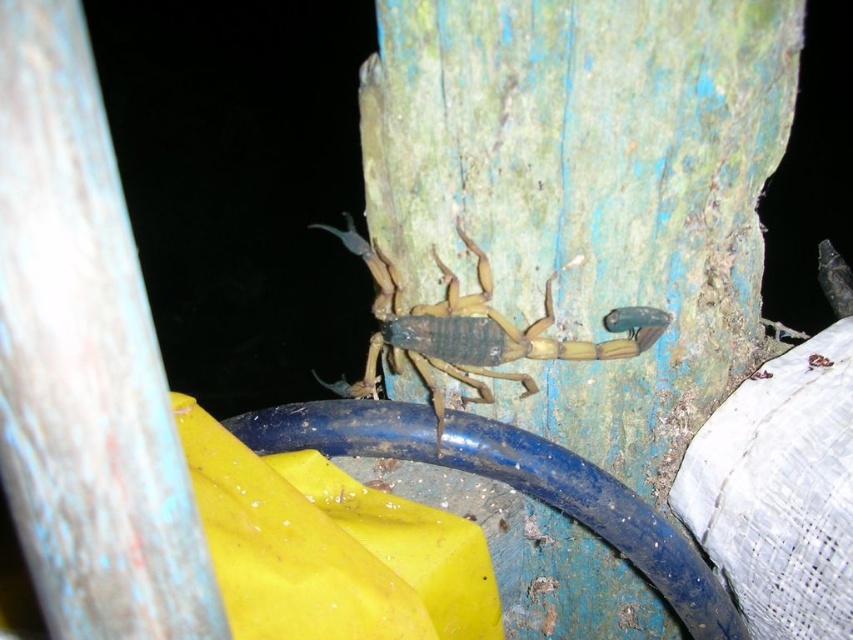
Question: Estimate the real-world distances between objects in this image. Which object is closer to the smooth blue wood at center?

Choices:
 (A) green weathered wood at center
 (B) brown matte scorpion at center

Answer: (B)

Question: Is smooth blue wood at center further to camera compared to brown matte scorpion at center?

Choices:
 (A) yes
 (B) no

Answer: (B)

Question: Which object is positioned farthest from the smooth blue wood at center?

Choices:
 (A) green weathered wood at center
 (B) brown matte scorpion at center

Answer: (A)

Question: Can you confirm if smooth blue wood at center is thinner than brown matte scorpion at center?

Choices:
 (A) no
 (B) yes

Answer: (B)

Question: Is smooth blue wood at center thinner than brown matte scorpion at center?

Choices:
 (A) yes
 (B) no

Answer: (A)

Question: Which object is positioned farthest from the smooth blue wood at center?

Choices:
 (A) green weathered wood at center
 (B) brown matte scorpion at center

Answer: (A)